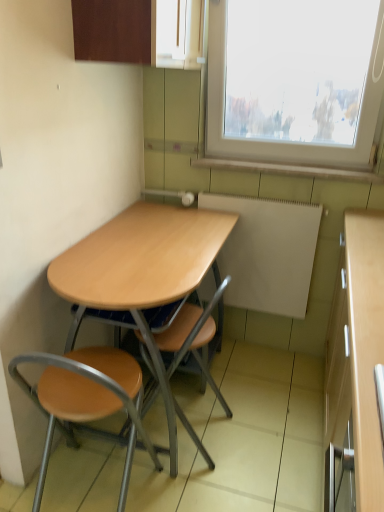
Identify the location of empty space that is ontop of green tile at upper right (from a real-world perspective). The height and width of the screenshot is (512, 384). (307, 155).